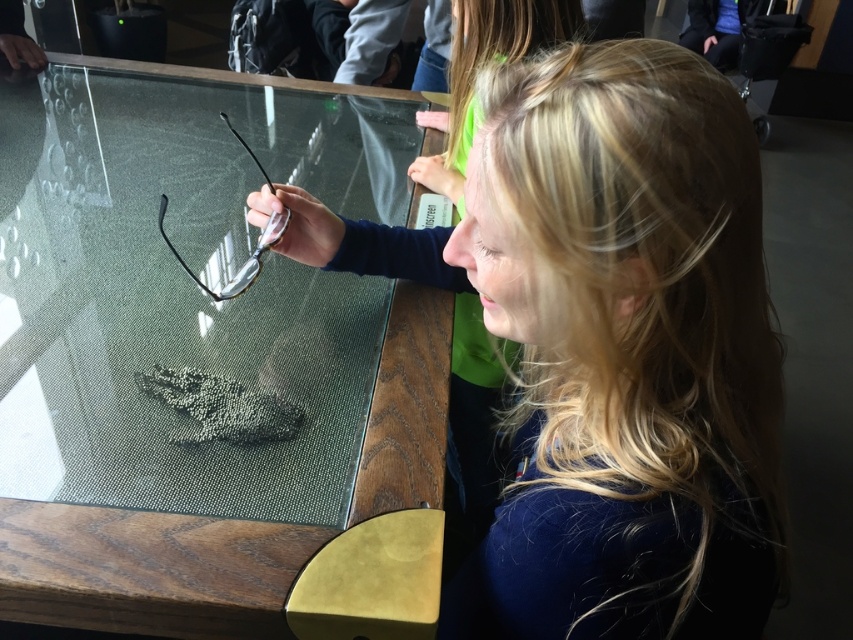
Question: Where is blonde hair at upper right located in relation to transparent textured glass at center in the image?

Choices:
 (A) left
 (B) right

Answer: (B)

Question: Is transparent textured glass at center smaller than black textured footprint at center?

Choices:
 (A) no
 (B) yes

Answer: (A)

Question: Which is nearer to the black textured footprint at center?

Choices:
 (A) transparent textured glass at center
 (B) blonde hair at upper right

Answer: (B)

Question: Considering the real-world distances, which object is closest to the blonde hair at upper right?

Choices:
 (A) transparent textured glass at center
 (B) black textured footprint at center

Answer: (A)

Question: Is the position of transparent textured glass at center more distant than that of black textured footprint at center?

Choices:
 (A) no
 (B) yes

Answer: (A)

Question: Which of the following is the farthest from the observer?

Choices:
 (A) transparent textured glass at center
 (B) blonde hair at upper right

Answer: (A)